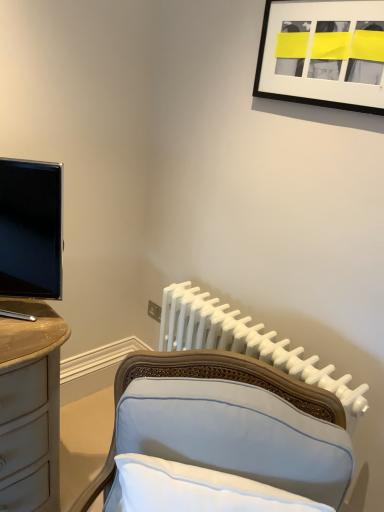
Question: Considering the relative sizes of matte black tv at left and white plastic radiator at center in the image provided, is matte black tv at left taller than white plastic radiator at center?

Choices:
 (A) no
 (B) yes

Answer: (A)

Question: From the image's perspective, is matte black tv at left on white plastic radiator at center?

Choices:
 (A) no
 (B) yes

Answer: (B)

Question: Can you confirm if matte black tv at left is wider than white plastic radiator at center?

Choices:
 (A) yes
 (B) no

Answer: (A)

Question: Considering the relative sizes of matte black tv at left and white plastic radiator at center in the image provided, is matte black tv at left bigger than white plastic radiator at center?

Choices:
 (A) no
 (B) yes

Answer: (A)

Question: Is matte black tv at left not near white plastic radiator at center?

Choices:
 (A) no
 (B) yes

Answer: (A)

Question: Are matte black tv at left and white plastic radiator at center beside each other?

Choices:
 (A) no
 (B) yes

Answer: (A)

Question: Can you see matte black tv at left touching light blue fabric chair at lower center?

Choices:
 (A) no
 (B) yes

Answer: (A)

Question: Could you tell me if matte black tv at left is facing light blue fabric chair at lower center?

Choices:
 (A) no
 (B) yes

Answer: (A)

Question: Considering the relative sizes of matte black tv at left and light blue fabric chair at lower center in the image provided, is matte black tv at left taller than light blue fabric chair at lower center?

Choices:
 (A) no
 (B) yes

Answer: (B)

Question: Does matte black tv at left come behind light blue fabric chair at lower center?

Choices:
 (A) yes
 (B) no

Answer: (A)

Question: Is matte black tv at left positioned in front of light blue fabric chair at lower center?

Choices:
 (A) yes
 (B) no

Answer: (B)

Question: Can you confirm if matte black tv at left is wider than light blue fabric chair at lower center?

Choices:
 (A) no
 (B) yes

Answer: (B)

Question: Is black matte picture frame at upper right closer to camera compared to matte black tv at left?

Choices:
 (A) yes
 (B) no

Answer: (B)